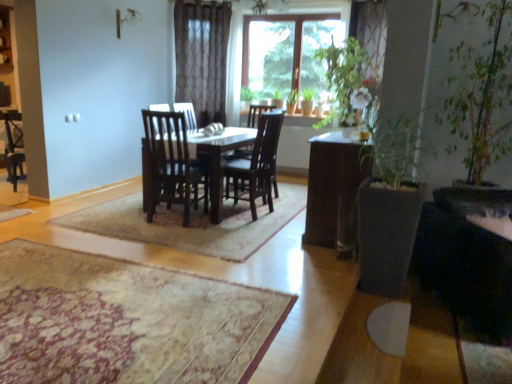
Identify the location of free space below beige textured rug at center (from a real-world perspective). The width and height of the screenshot is (512, 384). (83, 304).